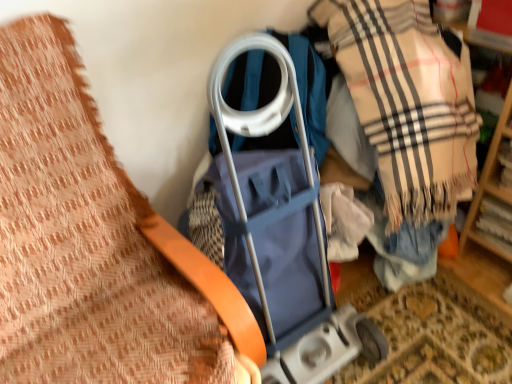
What do you see at coordinates (282, 218) in the screenshot?
I see `blue fabric baby carriage at center` at bounding box center [282, 218].

What is the approximate height of orange leather belt at upper left?

orange leather belt at upper left is 1.01 meters tall.

In order to click on beige plaid scarf at center right in this screenshot , I will do `click(408, 101)`.

Locate an element on the screen. This screenshot has width=512, height=384. blue fabric baby carriage at center is located at coordinates (282, 218).

In terms of width, does beige plaid scarf at center right look wider or thinner when compared to blue fabric baby carriage at center?

In the image, beige plaid scarf at center right appears to be more narrow than blue fabric baby carriage at center.

Based on the photo, is beige plaid scarf at center right with blue fabric baby carriage at center?

No, beige plaid scarf at center right is not next to blue fabric baby carriage at center.

Visually, is beige plaid scarf at center right positioned to the left or to the right of blue fabric baby carriage at center?

beige plaid scarf at center right is to the right of blue fabric baby carriage at center.

Is beige plaid scarf at center right oriented towards blue fabric baby carriage at center?

Yes, beige plaid scarf at center right is aimed at blue fabric baby carriage at center.

Is point (137, 353) farther from camera compared to point (279, 346)?

No.

In the image, is orange leather belt at upper left on the left side or the right side of blue fabric baby carriage at center?

orange leather belt at upper left is positioned on blue fabric baby carriage at center's left side.

Is orange leather belt at upper left far from blue fabric baby carriage at center?

Actually, orange leather belt at upper left and blue fabric baby carriage at center are a little close together.

Does orange leather belt at upper left turn towards blue fabric baby carriage at center?

No.

Is blue fabric baby carriage at center inside the boundaries of orange leather belt at upper left, or outside?

blue fabric baby carriage at center is not inside orange leather belt at upper left, it's outside.

Considering the relative positions of blue fabric baby carriage at center and orange leather belt at upper left in the image provided, is blue fabric baby carriage at center in front of orange leather belt at upper left?

No, blue fabric baby carriage at center is further to the viewer.

Is blue fabric baby carriage at center with orange leather belt at upper left?

No, blue fabric baby carriage at center is not making contact with orange leather belt at upper left.

Is blue fabric baby carriage at center to the right of orange leather belt at upper left from the viewer's perspective?

Indeed, blue fabric baby carriage at center is positioned on the right side of orange leather belt at upper left.

From the picture: From the image's perspective, between orange leather belt at upper left and beige plaid scarf at center right, who is located below?

orange leather belt at upper left.

From a real-world perspective, is orange leather belt at upper left over beige plaid scarf at center right?

Actually, orange leather belt at upper left is physically below beige plaid scarf at center right in the real world.

At what (x,y) coordinates should I click in order to perform the action: click on plaid lying on the right of orange leather belt at upper left. Please return your answer as a coordinate pair (x, y). The width and height of the screenshot is (512, 384). Looking at the image, I should click on (408, 101).

Who is shorter, orange leather belt at upper left or beige plaid scarf at center right?

Result: With less height is beige plaid scarf at center right.

In the scene shown: Considering the sizes of objects blue fabric baby carriage at center and beige plaid scarf at center right in the image provided, who is shorter, blue fabric baby carriage at center or beige plaid scarf at center right?

Result: Standing shorter between the two is blue fabric baby carriage at center.

In the image, is blue fabric baby carriage at center positioned in front of or behind beige plaid scarf at center right?

In the image, blue fabric baby carriage at center appears behind beige plaid scarf at center right.

Can you confirm if blue fabric baby carriage at center is thinner than beige plaid scarf at center right?

Incorrect, the width of blue fabric baby carriage at center is not less than that of beige plaid scarf at center right.

Which is more to the left, blue fabric baby carriage at center or beige plaid scarf at center right?

blue fabric baby carriage at center.

Is the depth of beige plaid scarf at center right greater than that of orange leather belt at upper left?

Yes, the depth of beige plaid scarf at center right is greater than that of orange leather belt at upper left.

Is beige plaid scarf at center right turned away from orange leather belt at upper left?

No.

Looking at this image, is orange leather belt at upper left a part of beige plaid scarf at center right?

Actually, orange leather belt at upper left is outside beige plaid scarf at center right.

Is beige plaid scarf at center right far away from orange leather belt at upper left?

They are positioned close to each other.

Where is `baby carriage behind the beige plaid scarf at center right`? Image resolution: width=512 pixels, height=384 pixels. baby carriage behind the beige plaid scarf at center right is located at coordinates (282, 218).

The width and height of the screenshot is (512, 384). In order to click on furniture above the blue fabric baby carriage at center (from a real-world perspective) in this screenshot , I will do `click(94, 244)`.

Estimate the real-world distances between objects in this image. Which object is closer to beige plaid scarf at center right, blue fabric baby carriage at center or orange leather belt at upper left?

blue fabric baby carriage at center.

When comparing their distances from blue fabric baby carriage at center, does orange leather belt at upper left or beige plaid scarf at center right seem closer?

Among the two, orange leather belt at upper left is located nearer to blue fabric baby carriage at center.

Looking at this image, which object lies nearer to the anchor point blue fabric baby carriage at center, beige plaid scarf at center right or orange leather belt at upper left?

orange leather belt at upper left is positioned closer to the anchor blue fabric baby carriage at center.

From the picture: Considering their positions, is blue fabric baby carriage at center positioned further to orange leather belt at upper left than beige plaid scarf at center right?

beige plaid scarf at center right lies further to orange leather belt at upper left than the other object.

Estimate the real-world distances between objects in this image. Which object is further from beige plaid scarf at center right, orange leather belt at upper left or blue fabric baby carriage at center?

orange leather belt at upper left is positioned further to the anchor beige plaid scarf at center right.

When comparing their distances from orange leather belt at upper left, does beige plaid scarf at center right or blue fabric baby carriage at center seem further?

The object further to orange leather belt at upper left is beige plaid scarf at center right.

At what (x,y) coordinates should I click in order to perform the action: click on plaid located between orange leather belt at upper left and blue fabric baby carriage at center in the depth direction. Please return your answer as a coordinate pair (x, y). This screenshot has height=384, width=512. Looking at the image, I should click on (408, 101).